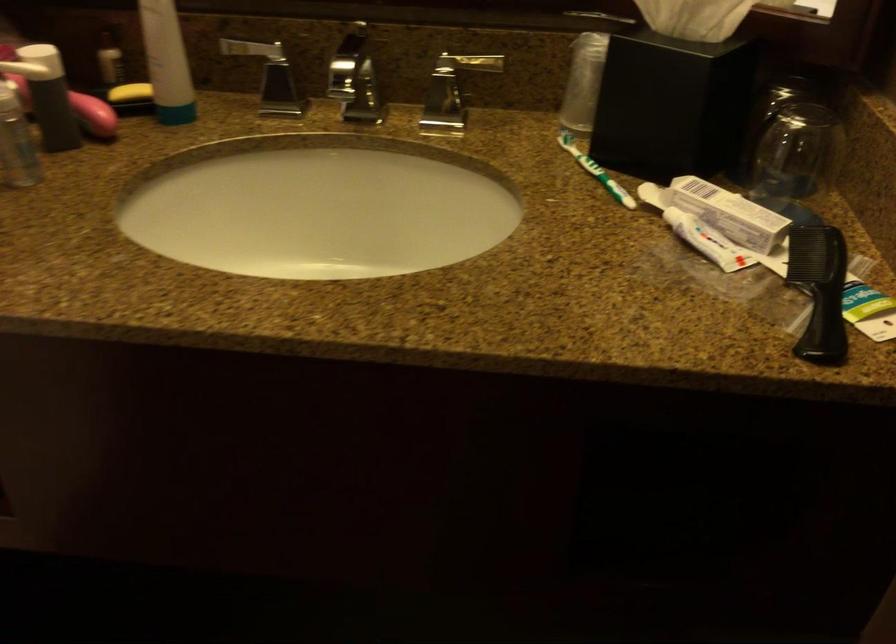
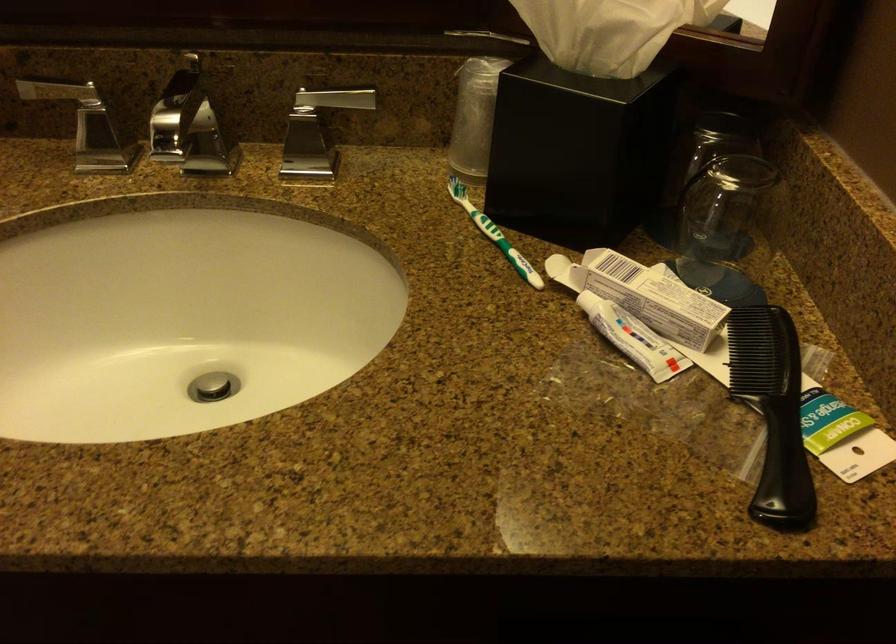
Locate, in the second image, the point that corresponds to (x=707, y=240) in the first image.

(633, 337)